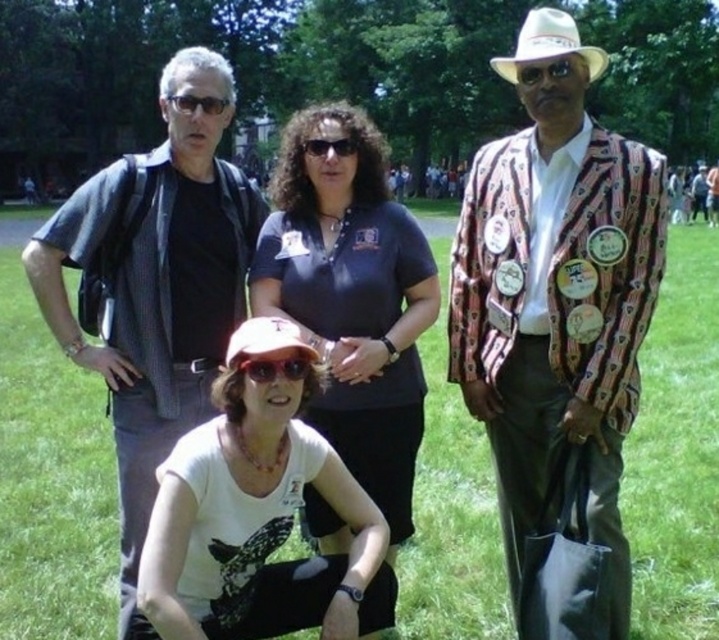
Question: Where is patterned fabric blazer at center located in relation to matte black shirt at left in the image?

Choices:
 (A) below
 (B) above

Answer: (A)

Question: Which point is closer to the camera taking this photo?

Choices:
 (A) (325, 417)
 (B) (211, 106)
 (C) (170, 109)

Answer: (B)

Question: Among these points, which one is farthest from the camera?

Choices:
 (A) (541, 326)
 (B) (338, 144)

Answer: (B)

Question: Which point is farther to the camera?

Choices:
 (A) white matte t-shirt at lower center
 (B) white felt cowboy hat at upper right
 (C) black plastic glasses at upper left
 (D) shiny silver goggles at center

Answer: (C)

Question: Can you confirm if white felt cowboy hat at upper right is positioned to the right of black plastic glasses at upper left?

Choices:
 (A) yes
 (B) no

Answer: (A)

Question: Does patterned fabric blazer at center have a greater width compared to black plastic goggles at upper center?

Choices:
 (A) no
 (B) yes

Answer: (B)